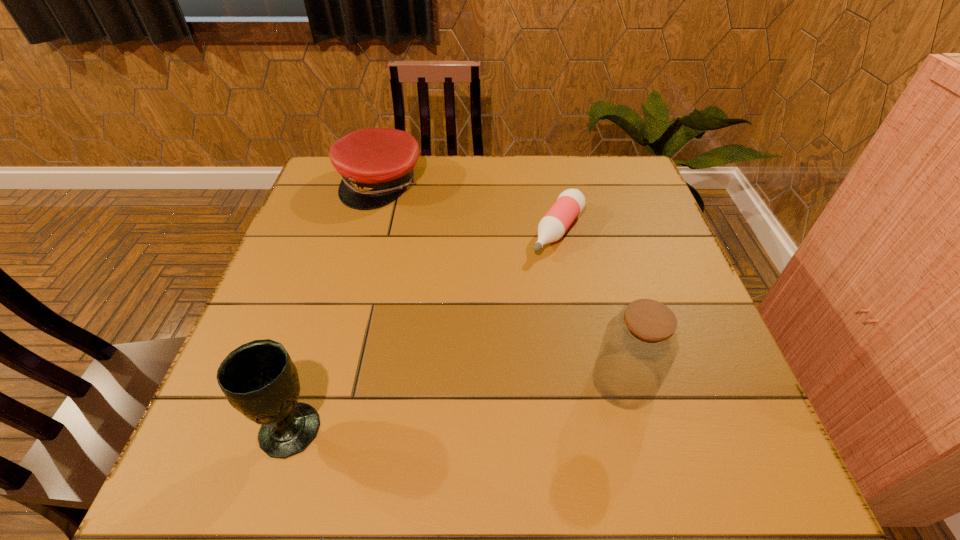
You are a GUI agent. You are given a task and a screenshot of the screen. Output one action in this format:
    pyautogui.click(x=<x>, y=<y>)
    Task: Click on the vacant region located with the cap open on the bottle
    This screenshot has height=540, width=960.
    Given the screenshot: What is the action you would take?
    pyautogui.click(x=492, y=333)

You are a GUI agent. You are given a task and a screenshot of the screen. Output one action in this format:
    pyautogui.click(x=<x>, y=<y>)
    Task: Click on the free space located with the cap open on the bottle
    
    Given the screenshot: What is the action you would take?
    pyautogui.click(x=516, y=299)

This screenshot has width=960, height=540. Find the location of `object that is positioned at the far edge`. object that is positioned at the far edge is located at coordinates point(376,164).

Locate an element on the screen. The width and height of the screenshot is (960, 540). chalice positioned at the near edge is located at coordinates pyautogui.click(x=259, y=379).

You are a GUI agent. You are given a task and a screenshot of the screen. Output one action in this format:
    pyautogui.click(x=<x>, y=<y>)
    Task: Click on the jar present at the near edge
    This screenshot has width=960, height=540.
    Given the screenshot: What is the action you would take?
    pyautogui.click(x=640, y=344)

This screenshot has height=540, width=960. Find the location of `chalice at the left edge`. chalice at the left edge is located at coordinates (259, 379).

The height and width of the screenshot is (540, 960). Find the location of `cap that is at the left edge`. cap that is at the left edge is located at coordinates (376, 164).

Identify the location of object that is positioned at the right edge. (640, 344).

At what (x,y) coordinates should I click in order to perform the action: click on object that is positioned at the far left corner. Please return your answer as a coordinate pair (x, y). This screenshot has height=540, width=960. Looking at the image, I should click on (376, 164).

Where is `object that is at the near left corner`? object that is at the near left corner is located at coordinates (259, 379).